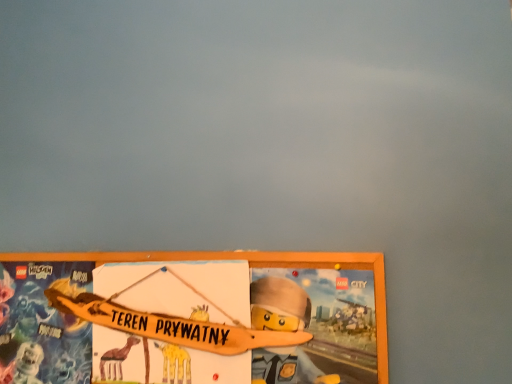
This screenshot has width=512, height=384. What do you see at coordinates (193, 318) in the screenshot?
I see `wooden signboard at center` at bounding box center [193, 318].

Identify the location of wooden signboard at center. This screenshot has height=384, width=512. (193, 318).

At what (x,y) coordinates should I click in order to perform the action: click on wooden signboard at center. Please return your answer as a coordinate pair (x, y). The width and height of the screenshot is (512, 384). Looking at the image, I should click on (193, 318).